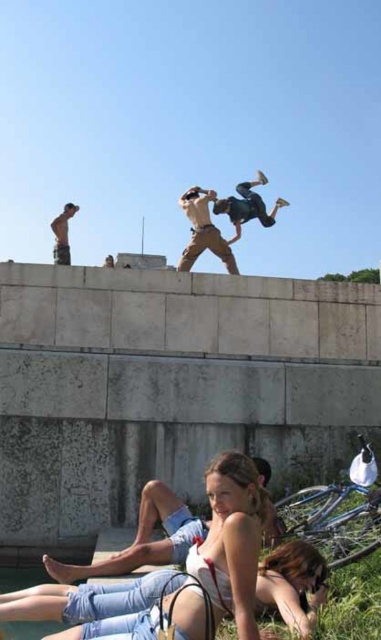
Question: Which point is closer to the camera taking this photo?

Choices:
 (A) (185, 264)
 (B) (54, 236)

Answer: (A)

Question: Which point is farther to the camera?

Choices:
 (A) shiny metallic torso at upper left
 (B) denim shorts at lower center

Answer: (A)

Question: Does denim shorts at lower center have a lesser width compared to matte khaki pants at center?

Choices:
 (A) yes
 (B) no

Answer: (B)

Question: From the image, what is the correct spatial relationship of denim shorts at lower center in relation to shiny metallic torso at upper left?

Choices:
 (A) left
 (B) right

Answer: (B)

Question: Which point is farther to the camera?

Choices:
 (A) (64, 221)
 (B) (233, 259)

Answer: (A)

Question: Can you confirm if denim shorts at lower center is wider than matte khaki pants at center?

Choices:
 (A) no
 (B) yes

Answer: (B)